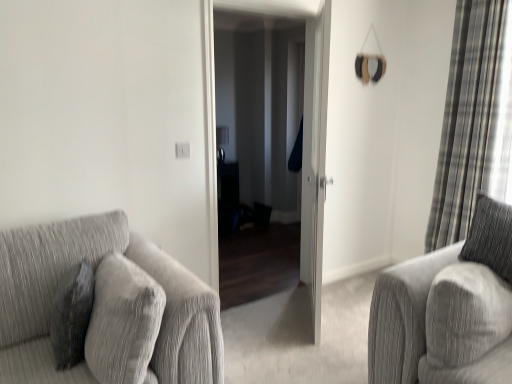
This screenshot has width=512, height=384. What are the coordinates of `unoccupied space behind matte black screen door at center, arranged as the 1th screen door when viewed from the left` in the screenshot? It's located at (269, 261).